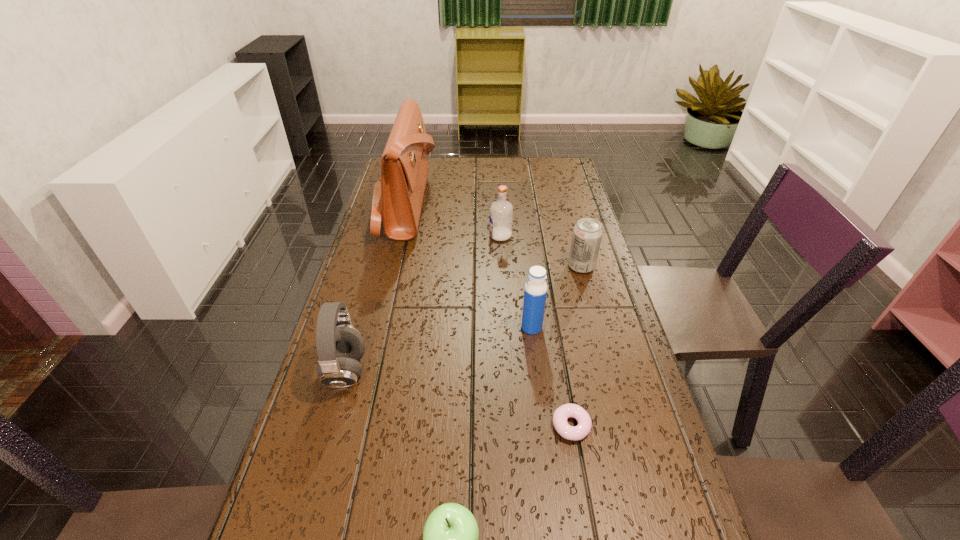
Where is `vacant point located 0.380m on the left of the water bottle`? The image size is (960, 540). vacant point located 0.380m on the left of the water bottle is located at coordinates [x=373, y=327].

Find the location of a particular element. Image resolution: width=960 pixels, height=540 pixels. vacant space located on the label of the vodka is located at coordinates (397, 236).

This screenshot has width=960, height=540. In order to click on free space located on the label of the vodka in this screenshot , I will do `click(382, 236)`.

You are a GUI agent. You are given a task and a screenshot of the screen. Output one action in this format:
    pyautogui.click(x=<x>, y=<y>)
    Task: Click on the vacant space situated on the label of the vodka
    The height and width of the screenshot is (540, 960).
    Given the screenshot: What is the action you would take?
    pyautogui.click(x=434, y=236)

Identify the location of free region located 0.230m on the front of the third farthest object. The image size is (960, 540). (600, 335).

Find the location of a particular element. This screenshot has width=960, height=540. vacant space positioned on the left of the doughnut is located at coordinates (452, 426).

Identify the location of object that is at the far edge. (398, 195).

I want to click on satchel at the left edge, so click(x=398, y=195).

Where is `headset present at the left edge`? headset present at the left edge is located at coordinates (340, 346).

This screenshot has width=960, height=540. I want to click on soda can that is positioned at the right edge, so click(x=587, y=234).